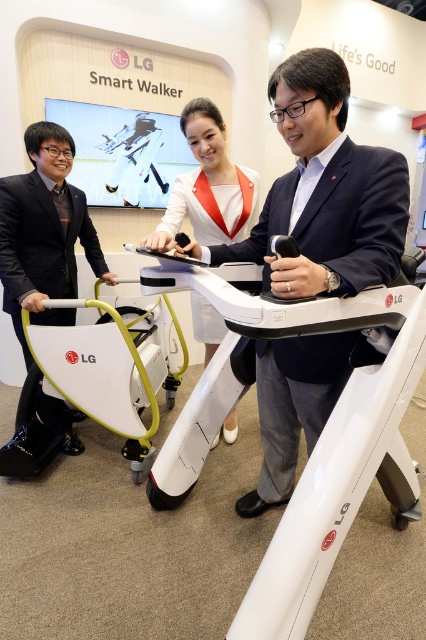
Question: Is matte black suit at left further to camera compared to white fabric dress at center?

Choices:
 (A) no
 (B) yes

Answer: (B)

Question: Which of these objects is positioned closest to the white plastic walker at center?

Choices:
 (A) matte black suit at left
 (B) dark blue fabric business suit at center

Answer: (A)

Question: Is the position of dark blue fabric business suit at center more distant than that of white plastic walker at center?

Choices:
 (A) yes
 (B) no

Answer: (B)

Question: Is matte black suit at left behind white fabric dress at center?

Choices:
 (A) no
 (B) yes

Answer: (B)

Question: Which point is closer to the camera?

Choices:
 (A) white plastic walker at center
 (B) matte black suit at left

Answer: (A)

Question: Which point appears farthest from the camera in this image?

Choices:
 (A) (327, 337)
 (B) (239, 236)
 (C) (31, 371)
 (D) (66, 259)

Answer: (D)